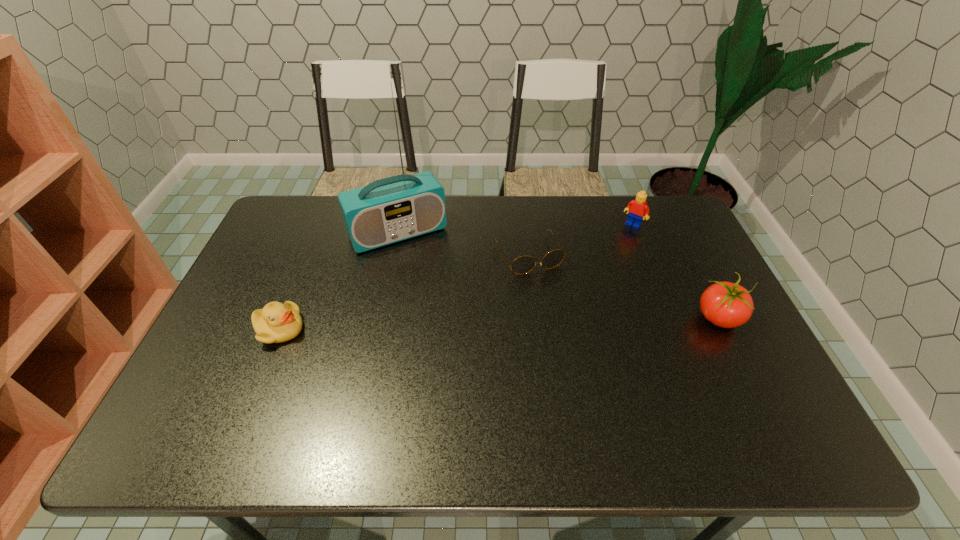
You are a GUI agent. You are given a task and a screenshot of the screen. Output one action in this format:
    pyautogui.click(x=<x>, y=<y>)
    Task: Click on the Lego that is at the far edge
    This screenshot has height=540, width=960.
    Given the screenshot: What is the action you would take?
    pyautogui.click(x=638, y=207)

The width and height of the screenshot is (960, 540). I want to click on sunglasses positioned at the far edge, so click(524, 264).

In order to click on object situated at the left edge in this screenshot , I will do `click(275, 323)`.

The height and width of the screenshot is (540, 960). Find the location of `tomato at the right edge`. tomato at the right edge is located at coordinates (724, 304).

Image resolution: width=960 pixels, height=540 pixels. Identify the location of Lego situated at the right edge. (638, 207).

You are a GUI agent. You are given a task and a screenshot of the screen. Output one action in this format:
    pyautogui.click(x=<x>, y=<y>)
    Task: Click on the object situated at the far right corner
    Image resolution: width=960 pixels, height=540 pixels.
    Given the screenshot: What is the action you would take?
    pyautogui.click(x=638, y=207)

Where is `vacant region at the far edge of the desktop`? The width and height of the screenshot is (960, 540). vacant region at the far edge of the desktop is located at coordinates (532, 199).

In the image, there is a desktop. Identify the location of vacant space at the near edge. (662, 388).

Image resolution: width=960 pixels, height=540 pixels. Identify the location of vacant space at the left edge. (229, 323).

In the image, there is a desktop. At what (x,y) coordinates should I click in order to perform the action: click on vacant space at the right edge. Please return your answer as a coordinate pair (x, y). Looking at the image, I should click on (668, 243).